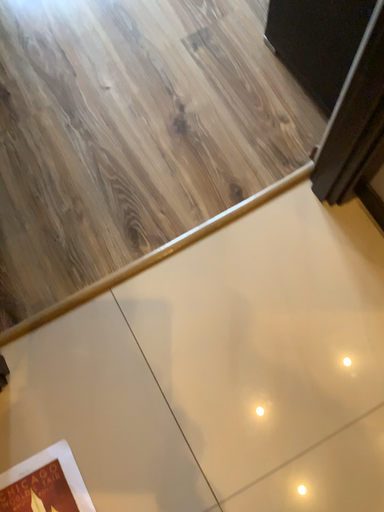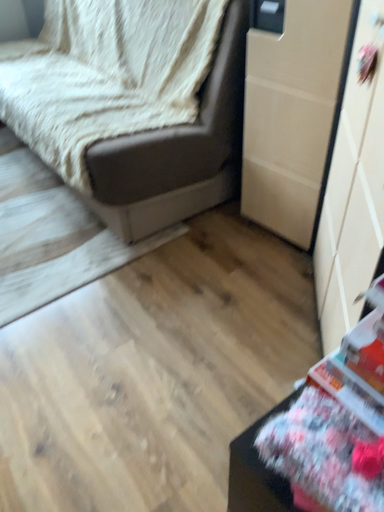
Question: Which way did the camera rotate in the video?

Choices:
 (A) rotated upward
 (B) rotated downward

Answer: (A)